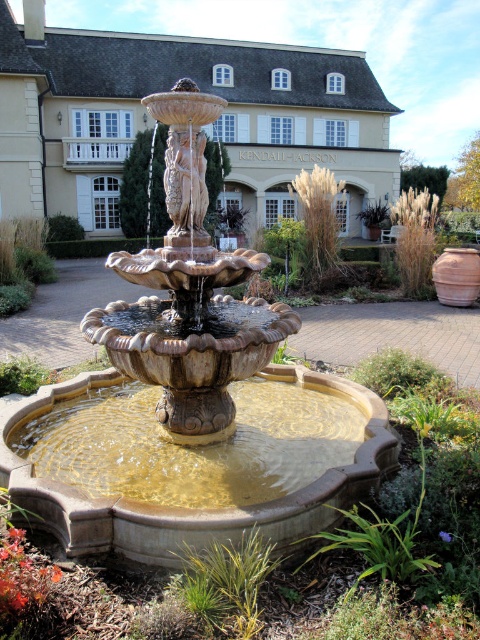
You are standing in front of the fountain and want to take a photo that includes both the point at coordinates point (x=232, y=388) and point (x=168, y=618). Which point is closer to the camera so you can ensure both are in focus?

Point (x=168, y=618) is closer to the camera than point (x=232, y=388), so you should focus on that point to ensure both are in focus.

You are standing in the garden and want to take a closer look at the matte stone fountain at center. If your walking path is 10 feet long from where you are standing, will you reach the fountain before the path ends?

The matte stone fountain at center is 9.56 feet from the camera, so yes, you can reach it before the 10 feet path ends.

You are standing in the garden looking at the brown stone fountain at center and the carved stone statue at center. Which object is closer to you?

The brown stone fountain at center is closer to you since it is in front of the carved stone statue at center.